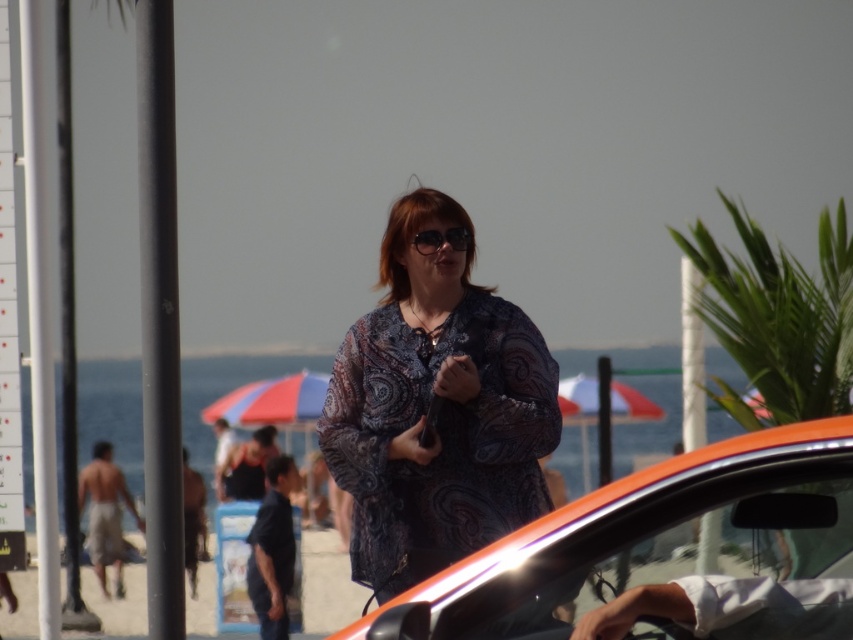
You are taking a photo of the beach scene. You want to focus on the point that is closer to the camera. Which point should you choose between point (752, 449) and point (465, 368)?

Point (752, 449) is closer to the camera than point (465, 368), so you should choose point (752, 449) to focus on.

You are a photographer trying to capture a candid shot of the woman in the beach scene. You notice the patterned fabric blouse at center and the matte black sunglasses at center. Which object is positioned more to the left side of the woman?

The patterned fabric blouse at center is positioned to the left of the matte black sunglasses at center, so it is more to the left side of the woman.